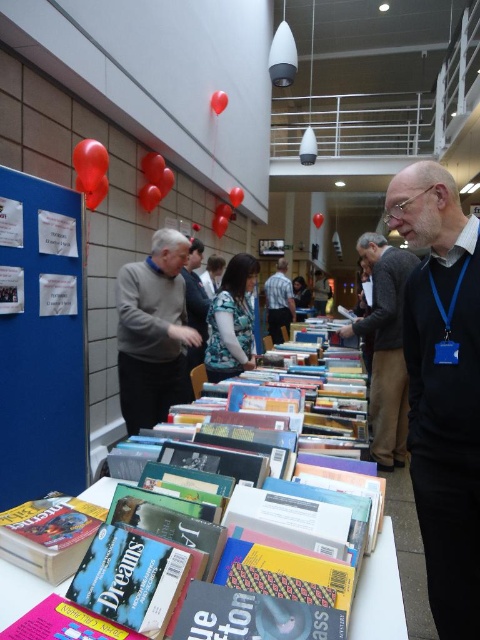
Question: Is black fabric shirt at right bigger than gray wool sweater at center?

Choices:
 (A) yes
 (B) no

Answer: (B)

Question: Does black fabric shirt at right appear on the right side of dark gray sweater at center?

Choices:
 (A) no
 (B) yes

Answer: (A)

Question: Among these points, which one is nearest to the camera?

Choices:
 (A) (210, 317)
 (B) (406, 374)
 (C) (188, 316)

Answer: (A)

Question: Considering the real-world distances, which object is closest to the multicolored paperbacks at center?

Choices:
 (A) dark gray sweater at center
 (B) striped shirt at center

Answer: (A)

Question: Is dark gray sweater at center smaller than blue textured blouse at center?

Choices:
 (A) yes
 (B) no

Answer: (B)

Question: Estimate the real-world distances between objects in this image. Which object is closer to the gray wool sweater at center?

Choices:
 (A) striped shirt at center
 (B) blue fabric shirt at center
 (C) black fabric shirt at right

Answer: (B)